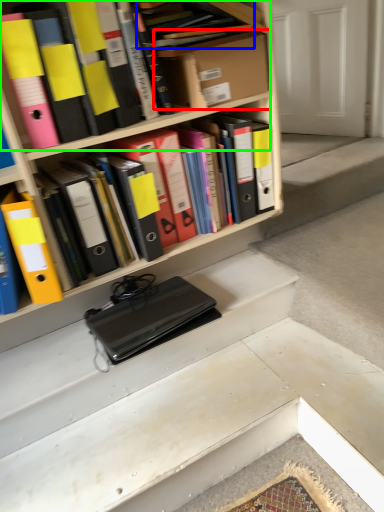
Question: Based on their relative distances, which object is nearer to cardboard box (highlighted by a red box)? Choose from book (highlighted by a blue box) and book (highlighted by a green box).

Choices:
 (A) book
 (B) book

Answer: (B)